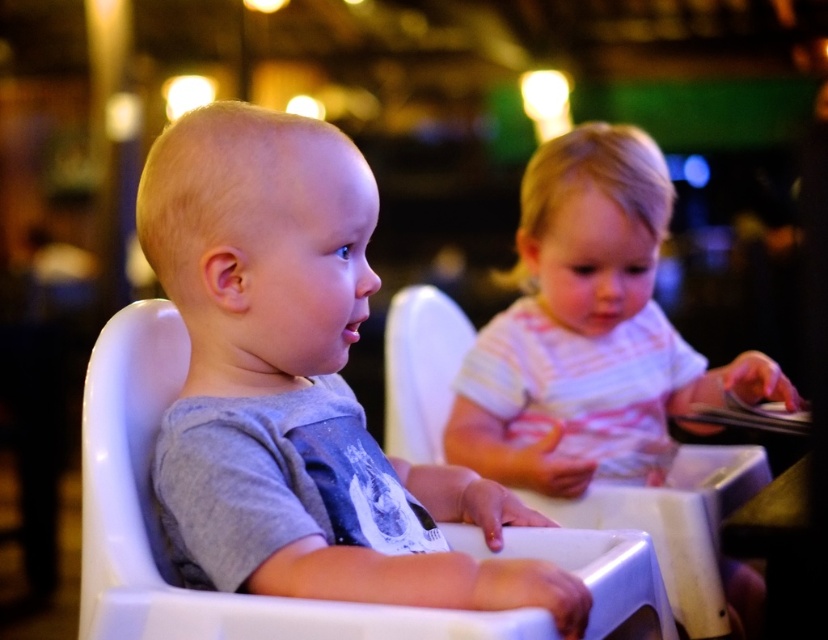
Consider the image. You are a photographer standing 10 feet away from the two children. You want to take a picture of both the gray matte shirt at left and the striped cotton shirt at right in the same frame. Given that your camera has a 50mm lens with a field of view that can capture objects up to 25 inches apart, will you be able to fit both shirts into the frame without moving closer?

The gray matte shirt at left is 21.39 inches away from the striped cotton shirt at right. Since the camera can capture up to 25 inches, the distance between them is within the field of view. Therefore, both shirts can be captured in the same frame without moving closer.

You are a photographer standing at the point marked as point (306, 147). You want to take a photo of the two children in the scene. Considering the camera is 96.84 centimeters away from your position, will you be able to capture both children in the frame without moving?

The camera is 96.84 centimeters away from point (306, 147), so yes, you can capture both children in the frame as the distance allows the camera to include both subjects without needing to move.

You are a photographer trying to decide how to arrange two children wearing the gray matte shirt at left and the striped cotton shirt at right for a photo shoot. Based on their clothing sizes, which child should you place closer to the camera to make them appear more balanced in size?

The gray matte shirt at left is smaller than the striped cotton shirt at right, so you should place the child in the gray matte shirt at left closer to the camera to balance their apparent sizes.